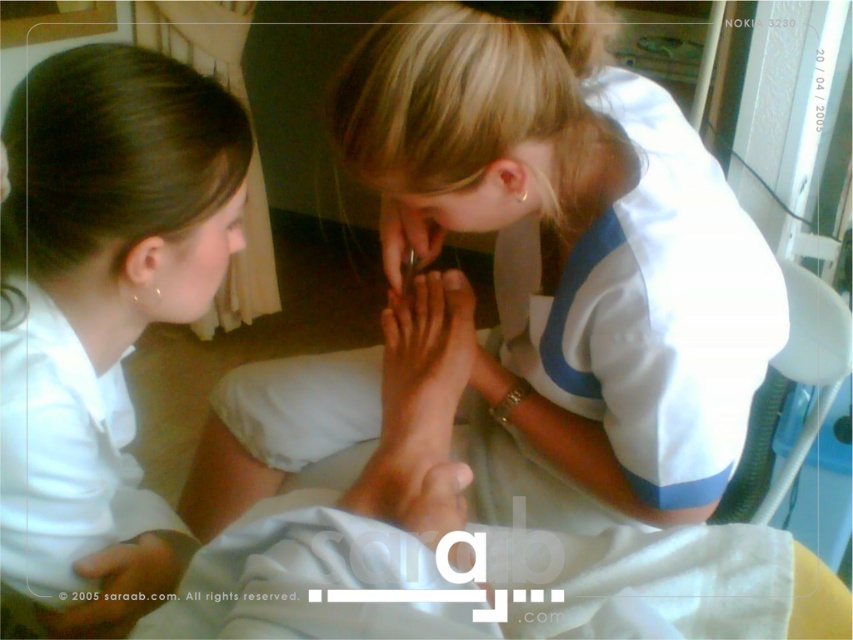
I want to click on white smooth shirt at left, so click(102, 305).

Does white smooth shirt at left come behind light skin tone hand at center?

No, it is in front of light skin tone hand at center.

Who is more distant from viewer, (62, 276) or (432, 371)?

The point (432, 371) is more distant.

This screenshot has height=640, width=853. Identify the location of white smooth shirt at left. (102, 305).

Which of these two, white smooth skin at lower left or blonde hair at upper center, stands shorter?

blonde hair at upper center

In the scene shown: Can you confirm if white smooth skin at lower left is positioned to the left of blonde hair at upper center?

Indeed, white smooth skin at lower left is positioned on the left side of blonde hair at upper center.

This screenshot has height=640, width=853. What do you see at coordinates (577, 248) in the screenshot?
I see `white smooth skin at lower left` at bounding box center [577, 248].

The width and height of the screenshot is (853, 640). In order to click on white smooth skin at lower left in this screenshot , I will do `click(577, 248)`.

The height and width of the screenshot is (640, 853). Find the location of `light skin tone hand at center`. light skin tone hand at center is located at coordinates (425, 362).

Which of these two, light skin tone hand at center or smooth skin hand at lower center, stands shorter?

Standing shorter between the two is smooth skin hand at lower center.

The width and height of the screenshot is (853, 640). Find the location of `light skin tone hand at center`. light skin tone hand at center is located at coordinates (425, 362).

This screenshot has height=640, width=853. Identify the location of light skin tone hand at center. (425, 362).